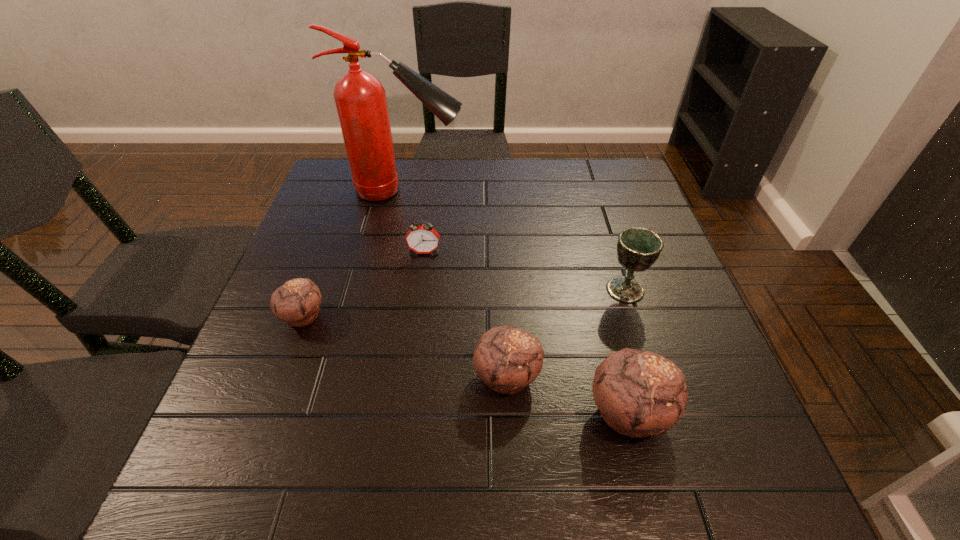
The image size is (960, 540). I want to click on vacant spot for a new muffin to ensure equal spacing, so click(x=399, y=345).